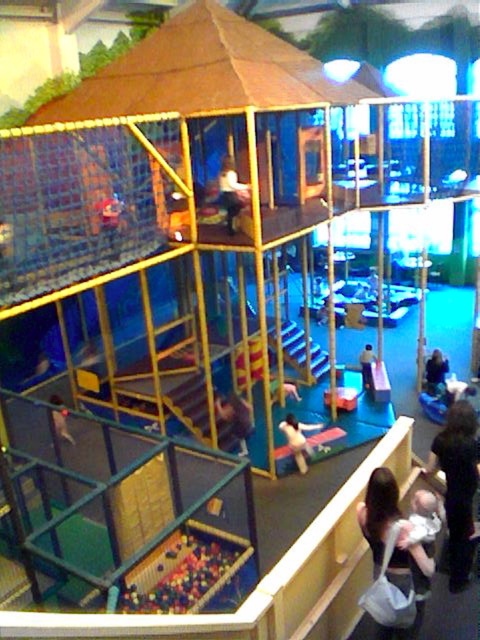
Question: Which object is closer to the camera taking this photo?

Choices:
 (A) smooth blue fabric at center
 (B) smooth brown hair at upper center
 (C) dark brown hair at lower right

Answer: (C)

Question: Does multicolored plastic balls at lower center appear under smooth brown hair at upper center?

Choices:
 (A) no
 (B) yes

Answer: (B)

Question: Is multicolored plastic balls at lower center smaller than smooth blue fabric at center?

Choices:
 (A) no
 (B) yes

Answer: (A)

Question: Among these points, which one is farthest from the camera?

Choices:
 (A) (165, 589)
 (B) (450, 520)
 (C) (242, 404)
 (D) (364, 355)

Answer: (D)

Question: Is dark brown hair at lower right closer to the viewer compared to smooth brown hair at center?

Choices:
 (A) no
 (B) yes

Answer: (B)

Question: Which object appears closest to the camera in this image?

Choices:
 (A) smooth white shirt at center
 (B) smooth blue fabric at center

Answer: (B)